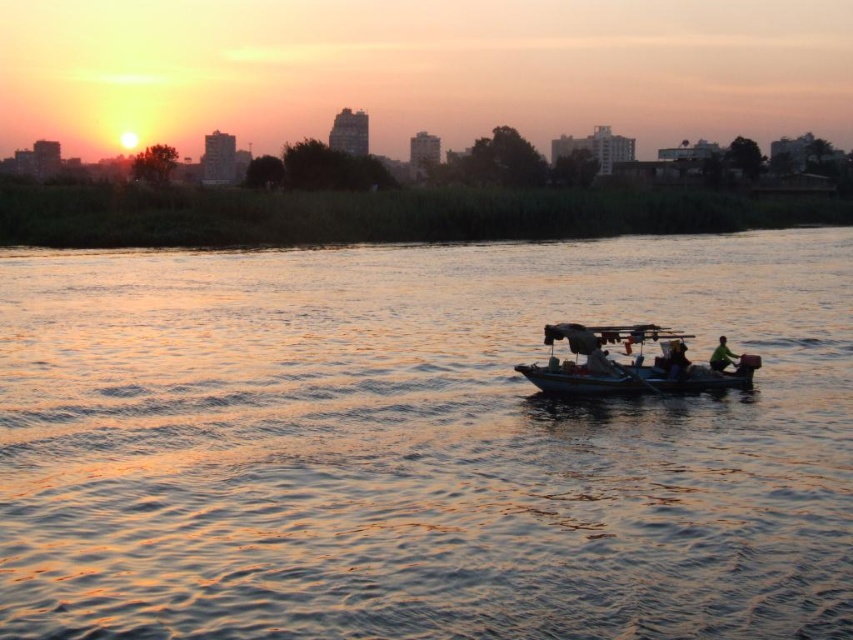
Question: Which is nearer to the golden reflective water at center?

Choices:
 (A) green fabric boat at center
 (B) green matte jacket at center
 (C) smooth fabric person at center

Answer: (A)

Question: Does smooth fabric person at center appear under green fabric boat at center?

Choices:
 (A) yes
 (B) no

Answer: (B)

Question: Does golden reflective water at center lie in front of green matte jacket at center?

Choices:
 (A) no
 (B) yes

Answer: (B)

Question: Which point is farther from the camera taking this photo?

Choices:
 (A) (675, 356)
 (B) (86, 536)
 (C) (605, 372)
 (D) (532, 378)

Answer: (A)

Question: Which point is farther from the camera taking this photo?

Choices:
 (A) (682, 376)
 (B) (732, 355)

Answer: (B)

Question: Does metallic gray boat at center have a greater width compared to green matte jacket at center?

Choices:
 (A) no
 (B) yes

Answer: (B)